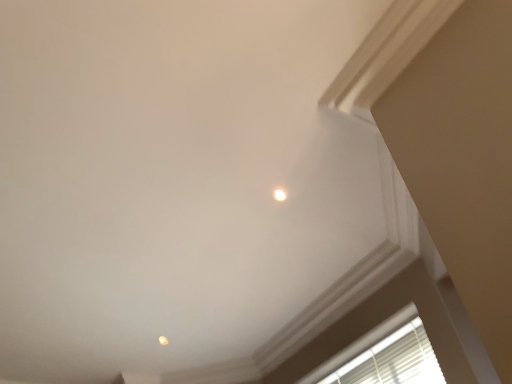
Question: Is matte orange light at upper center, which is counted as the first dot, starting from the back, at the back of white glossy light fixture at upper center, the second dot when ordered from left to right?

Choices:
 (A) no
 (B) yes

Answer: (A)

Question: Considering the relative sizes of white glossy light fixture at upper center, placed as the first dot when sorted from right to left, and matte orange light at upper center, arranged as the 1th dot when ordered from the bottom, in the image provided, is white glossy light fixture at upper center, placed as the first dot when sorted from right to left, thinner than matte orange light at upper center, arranged as the 1th dot when ordered from the bottom,?

Choices:
 (A) yes
 (B) no

Answer: (B)

Question: Is the depth of white glossy light fixture at upper center, the second dot ordered from the bottom, less than that of matte orange light at upper center, acting as the 2th dot starting from the front?

Choices:
 (A) no
 (B) yes

Answer: (B)

Question: Is white glossy light fixture at upper center, the second dot when ordered from left to right, directly adjacent to matte orange light at upper center, placed as the second dot when sorted from right to left?

Choices:
 (A) no
 (B) yes

Answer: (A)

Question: From a real-world perspective, is white glossy light fixture at upper center, placed as the first dot when sorted from right to left, physically below matte orange light at upper center, which is counted as the first dot, starting from the back?

Choices:
 (A) yes
 (B) no

Answer: (B)

Question: Considering the positions of white glossy light fixture at upper center, the second dot when ordered from left to right, and matte orange light at upper center, acting as the 2th dot starting from the front, in the image, is white glossy light fixture at upper center, the second dot when ordered from left to right, wider or thinner than matte orange light at upper center, acting as the 2th dot starting from the front,?

Choices:
 (A) wide
 (B) thin

Answer: (A)

Question: Does point (283, 195) appear closer or farther from the camera than point (158, 339)?

Choices:
 (A) farther
 (B) closer

Answer: (B)

Question: Considering the positions of white glossy light fixture at upper center, which is counted as the 1th dot, starting from the top, and matte orange light at upper center, arranged as the 1th dot when ordered from the bottom, in the image, is white glossy light fixture at upper center, which is counted as the 1th dot, starting from the top, taller or shorter than matte orange light at upper center, arranged as the 1th dot when ordered from the bottom,?

Choices:
 (A) tall
 (B) short

Answer: (B)

Question: Would you say white glossy light fixture at upper center, which appears as the first dot when viewed from the front, is to the left or to the right of matte orange light at upper center, acting as the 2th dot starting from the front, in the picture?

Choices:
 (A) left
 (B) right

Answer: (B)

Question: Is matte orange light at upper center, placed as the second dot when sorted from right to left, taller or shorter than white blinds at lower right?

Choices:
 (A) short
 (B) tall

Answer: (A)

Question: Based on their sizes in the image, would you say matte orange light at upper center, marked as the 1th dot in a left-to-right arrangement, is bigger or smaller than white blinds at lower right?

Choices:
 (A) small
 (B) big

Answer: (A)

Question: Is point (160, 337) positioned closer to the camera than point (379, 365)?

Choices:
 (A) closer
 (B) farther

Answer: (B)

Question: From a real-world perspective, is matte orange light at upper center, acting as the 2th dot starting from the front, positioned above or below white blinds at lower right?

Choices:
 (A) below
 (B) above

Answer: (B)

Question: Based on their positions, is matte orange light at upper center, which is counted as the first dot, starting from the back, located to the left or right of white glossy light fixture at upper center, placed as the first dot when sorted from right to left?

Choices:
 (A) right
 (B) left

Answer: (B)

Question: From the image's perspective, relative to white glossy light fixture at upper center, the 2th dot viewed from the back, is matte orange light at upper center, which is counted as the first dot, starting from the back, above or below?

Choices:
 (A) above
 (B) below

Answer: (B)